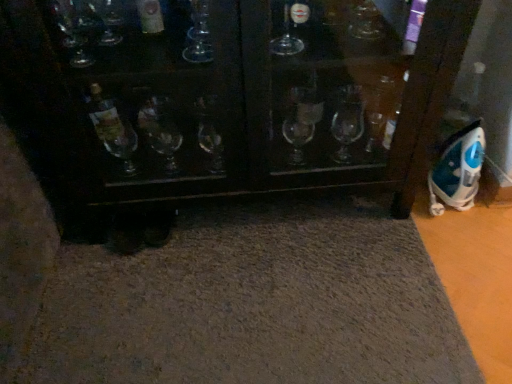
Identify the location of blank area to the left of blue plastic iron at right. The height and width of the screenshot is (384, 512). (389, 218).